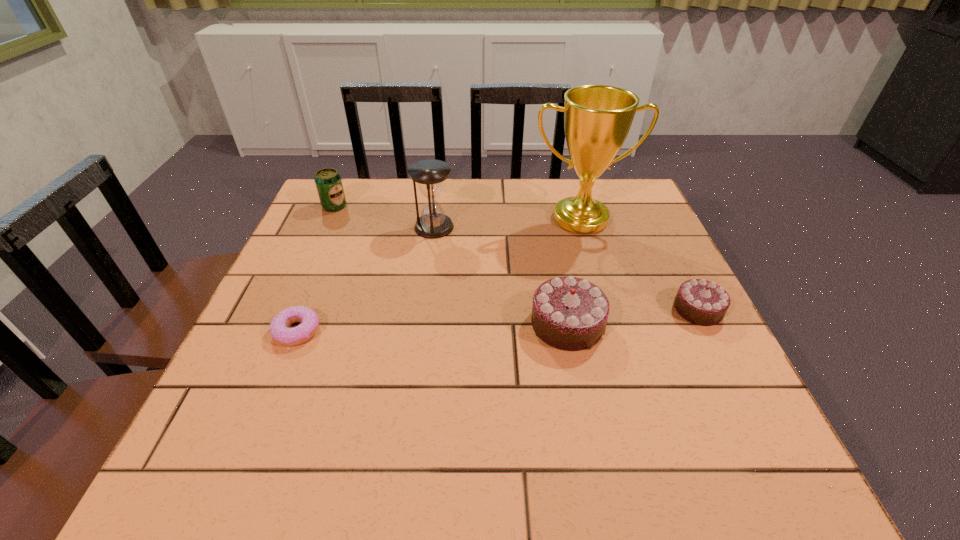
The height and width of the screenshot is (540, 960). What are the coordinates of `blank area located 0.360m on the front of the beer can` in the screenshot? It's located at (289, 308).

Find the location of a particular element. The height and width of the screenshot is (540, 960). free space located 0.210m by the handles of the award is located at coordinates (602, 294).

I want to click on vacant area located on the back of the shortest object, so click(x=313, y=292).

Locate an element on the screen. vacant region located 0.160m on the front of the hourglass is located at coordinates (427, 281).

What are the coordinates of `beer can that is at the far edge` in the screenshot? It's located at (328, 182).

This screenshot has width=960, height=540. I want to click on award that is at the far edge, so click(x=597, y=118).

Where is `hourglass located in the far edge section of the desktop`? hourglass located in the far edge section of the desktop is located at coordinates (429, 174).

You are a GUI agent. You are given a task and a screenshot of the screen. Output one action in this format:
    pyautogui.click(x=<x>, y=<y>)
    Task: Click on the beer can situated at the left edge
    The height and width of the screenshot is (540, 960).
    Given the screenshot: What is the action you would take?
    pyautogui.click(x=328, y=182)

Find the location of a particular element. doughnut present at the left edge is located at coordinates (279, 330).

At what (x,y) coordinates should I click in order to perform the action: click on chocolate cake present at the right edge. Please return your answer as a coordinate pair (x, y). The width and height of the screenshot is (960, 540). Looking at the image, I should click on (699, 301).